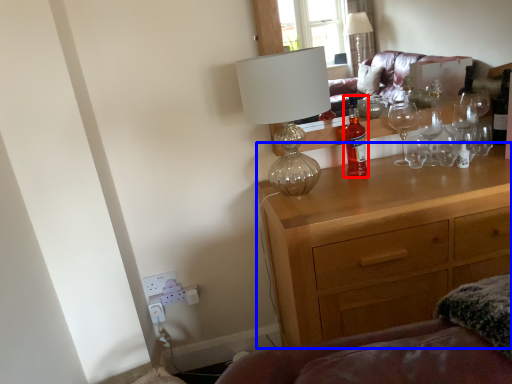
Question: Among these objects, which one is farthest to the camera, bottle (highlighted by a red box) or chest of drawers (highlighted by a blue box)?

Choices:
 (A) bottle
 (B) chest of drawers

Answer: (A)